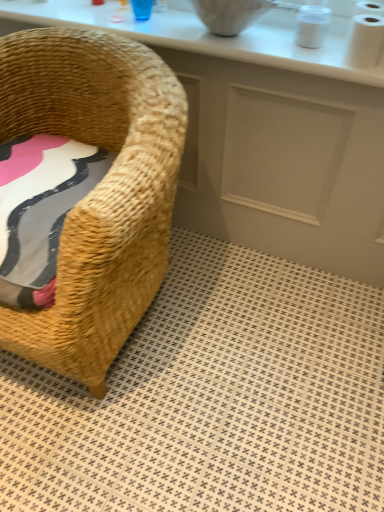
Question: In terms of height, does beige woven rug at lower left look taller or shorter compared to woven straw chair at left?

Choices:
 (A) tall
 (B) short

Answer: (B)

Question: Is beige woven rug at lower left spatially inside woven straw chair at left, or outside of it?

Choices:
 (A) outside
 (B) inside

Answer: (A)

Question: Which is nearer to the white matte toilet paper at upper right?

Choices:
 (A) white glossy counter at upper center
 (B) woven straw chair at left
 (C) white glossy counter top at upper center
 (D) beige woven rug at lower left

Answer: (C)

Question: Which object is positioned closest to the white matte toilet paper at upper right?

Choices:
 (A) white glossy counter at upper center
 (B) white glossy counter top at upper center
 (C) woven straw chair at left
 (D) beige woven rug at lower left

Answer: (B)